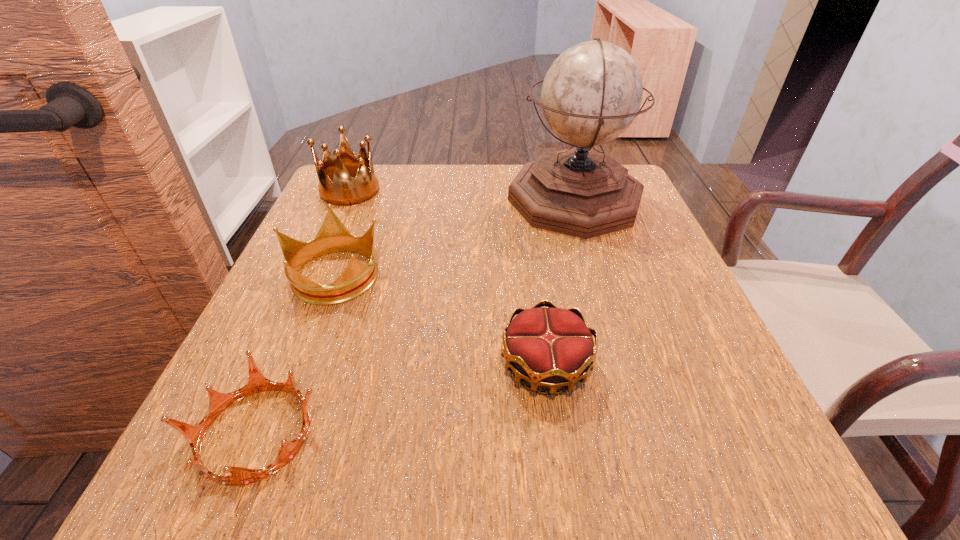
Find the location of a particular element. This screenshot has height=540, width=960. the fourth closest object to the globe is located at coordinates (218, 402).

Locate an element on the screen. crown that is the second closest one to the fourth shortest object is located at coordinates (552, 347).

Select which crown is the closest to the third shortest object. Please provide its 2D coordinates. Your answer should be formatted as a tuple, i.e. [(x, y)], where the tuple contains the x and y coordinates of a point satisfying the conditions above.

[(218, 402)]

Locate an element on the screen. This screenshot has height=540, width=960. vacant area in the image that satisfies the following two spatial constraints: 1. on the front side of the third nearest object; 2. on the right side of the farthest crown is located at coordinates (313, 274).